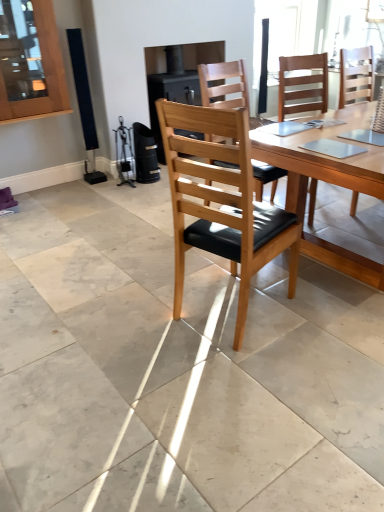
Find the location of a particular element. The width and height of the screenshot is (384, 512). free point to the left of wooden chair with black cushion at center, which is the third chair from back to front is located at coordinates (145, 315).